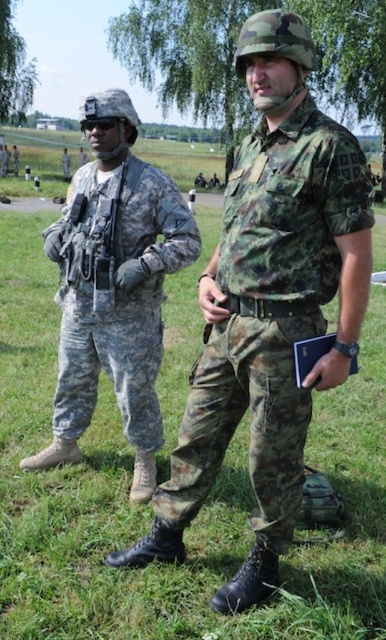
Is camouflage fabric shirt at center positioned behind matte black rifle at left?

No, it is not.

Who is shorter, camouflage fabric shirt at center or matte black rifle at left?

With less height is matte black rifle at left.

Between point (274, 310) and point (91, 275), which one is positioned in front?

Point (274, 310)

Locate an element on the screen. The width and height of the screenshot is (386, 640). camouflage fabric shirt at center is located at coordinates click(x=269, y=312).

Between camouflage fabric pants at left and matte black rifle at left, which one has less height?

With less height is matte black rifle at left.

Between camouflage fabric pants at left and matte black rifle at left, which one is positioned lower?

camouflage fabric pants at left is lower down.

Does point (69, 244) lie behind point (111, 216)?

Yes, point (69, 244) is farther from viewer.

Locate an element on the screen. The height and width of the screenshot is (640, 386). camouflage fabric pants at left is located at coordinates (118, 294).

Does camouflage fabric shirt at center have a greater height compared to camouflage fabric pants at left?

Yes, camouflage fabric shirt at center is taller than camouflage fabric pants at left.

Is the position of camouflage fabric shirt at center less distant than that of camouflage fabric pants at left?

Yes, camouflage fabric shirt at center is closer to the viewer.

Which is behind, point (221, 241) or point (106, 294)?

Point (106, 294)

Where is `camouflage fabric shirt at center`? The height and width of the screenshot is (640, 386). camouflage fabric shirt at center is located at coordinates (269, 312).